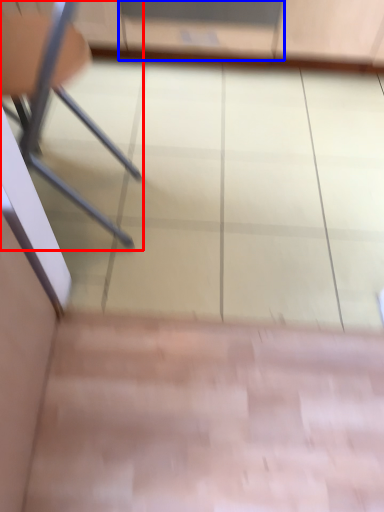
Question: Among these objects, which one is farthest to the camera, chair (highlighted by a red box) or screen door (highlighted by a blue box)?

Choices:
 (A) chair
 (B) screen door

Answer: (B)